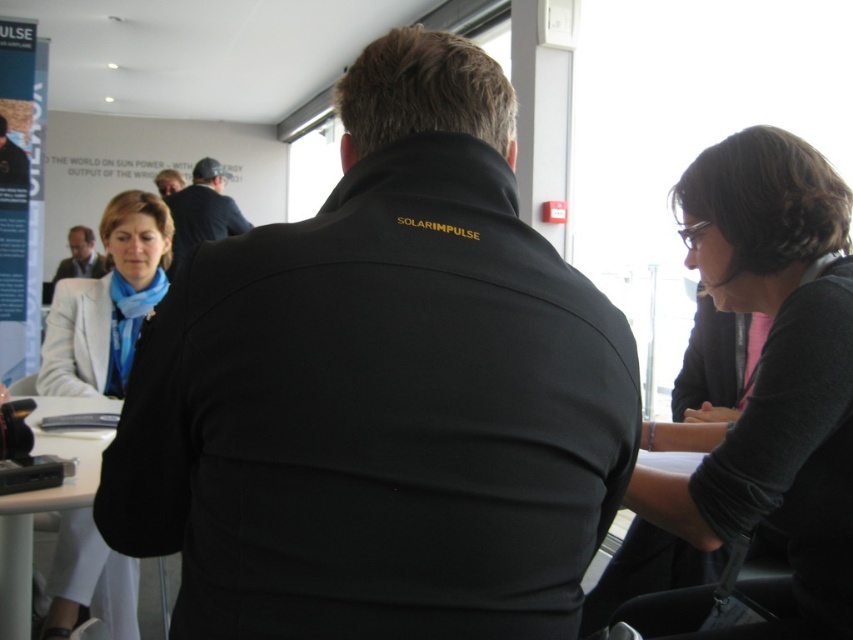
Question: Considering the real-world distances, which object is closest to the matte black jacket at center?

Choices:
 (A) dark gray sweater at right
 (B) white matte table at lower left
 (C) white fabric jacket at left

Answer: (C)

Question: Can you confirm if white fabric jacket at left is bigger than dark blue shirt at center?

Choices:
 (A) yes
 (B) no

Answer: (B)

Question: Which object is the closest to the black softshell jacket at center?

Choices:
 (A) dark blue shirt at center
 (B) matte black jacket at center

Answer: (A)

Question: Does white matte table at lower left have a greater width compared to matte black laptop at left?

Choices:
 (A) no
 (B) yes

Answer: (A)

Question: Is white fabric jacket at left wider than dark blue shirt at center?

Choices:
 (A) yes
 (B) no

Answer: (B)

Question: Estimate the real-world distances between objects in this image. Which object is farther from the matte black laptop at left?

Choices:
 (A) black softshell jacket at center
 (B) dark blue shirt at center
 (C) white fabric jacket at left

Answer: (A)